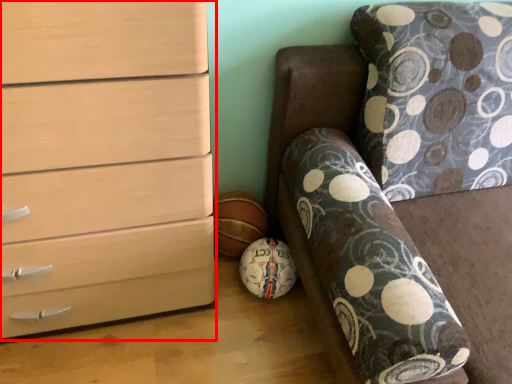
Question: Considering the relative positions of chest of drawers (annotated by the red box) and furniture in the image provided, where is chest of drawers (annotated by the red box) located with respect to the staircase?

Choices:
 (A) left
 (B) right

Answer: (A)